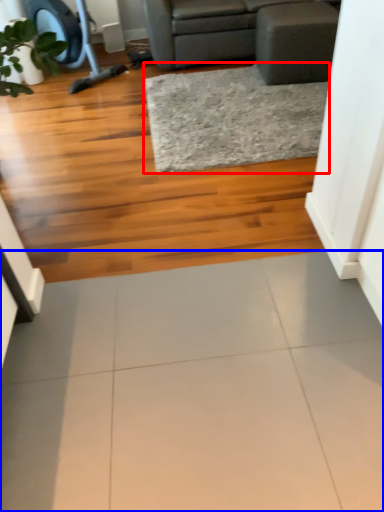
Question: Which point is further to the camera, mat (highlighted by a red box) or ceramic tile (highlighted by a blue box)?

Choices:
 (A) mat
 (B) ceramic tile

Answer: (A)